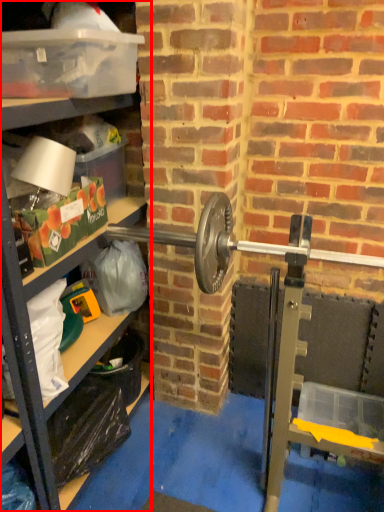
Question: From the image's perspective, considering the relative positions of shelf (annotated by the red box) and box in the image provided, where is shelf (annotated by the red box) located with respect to the staircase?

Choices:
 (A) above
 (B) below

Answer: (B)